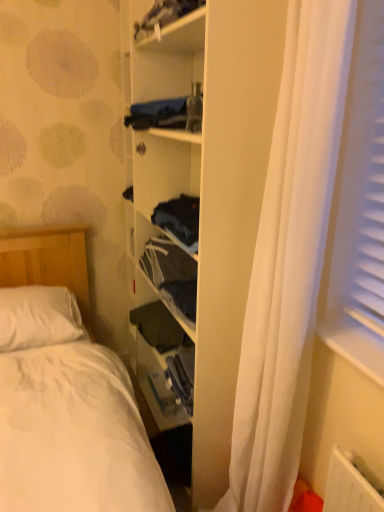
Question: Is dark blue fabric at upper center at the right side of wooden bookshelf at center?

Choices:
 (A) yes
 (B) no

Answer: (B)

Question: Is dark blue fabric at upper center further to camera compared to wooden bookshelf at center?

Choices:
 (A) yes
 (B) no

Answer: (A)

Question: From the image's perspective, does dark blue fabric at upper center appear lower than wooden bookshelf at center?

Choices:
 (A) yes
 (B) no

Answer: (B)

Question: Is dark blue fabric at upper center closer to the viewer compared to wooden bookshelf at center?

Choices:
 (A) yes
 (B) no

Answer: (B)

Question: From a real-world perspective, does dark blue fabric at upper center stand above wooden bookshelf at center?

Choices:
 (A) yes
 (B) no

Answer: (A)

Question: From a real-world perspective, is dark blue fabric at upper center beneath wooden bookshelf at center?

Choices:
 (A) yes
 (B) no

Answer: (B)

Question: Is dark blue fabric at upper center bigger than white fabric curtain at center?

Choices:
 (A) no
 (B) yes

Answer: (A)

Question: Is dark blue fabric at upper center positioned with its back to white fabric curtain at center?

Choices:
 (A) no
 (B) yes

Answer: (A)

Question: Is dark blue fabric at upper center positioned behind white fabric curtain at center?

Choices:
 (A) no
 (B) yes

Answer: (B)

Question: Can we say dark blue fabric at upper center lies outside white fabric curtain at center?

Choices:
 (A) yes
 (B) no

Answer: (A)

Question: Considering the relative sizes of dark blue fabric at upper center and white fabric curtain at center in the image provided, is dark blue fabric at upper center thinner than white fabric curtain at center?

Choices:
 (A) no
 (B) yes

Answer: (B)

Question: From a real-world perspective, does dark blue fabric at upper center stand above white fabric curtain at center?

Choices:
 (A) yes
 (B) no

Answer: (A)

Question: Is white fabric curtain at center aimed at dark blue fabric at upper center?

Choices:
 (A) yes
 (B) no

Answer: (B)